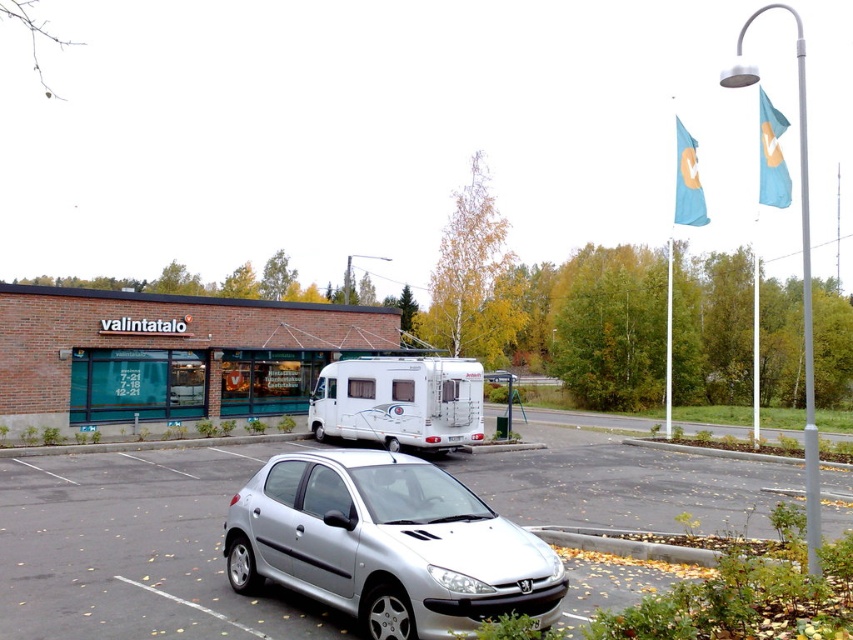
Looking at this image, does silver metallic car at center appear over silver metallic car at lower center?

Actually, silver metallic car at center is below silver metallic car at lower center.

Is silver metallic car at center to the left of silver metallic car at lower center from the viewer's perspective?

Incorrect, silver metallic car at center is not on the left side of silver metallic car at lower center.

Is point (97, 589) farther from camera compared to point (253, 534)?

Yes, point (97, 589) is behind point (253, 534).

What are the coordinates of `silver metallic car at center` in the screenshot? It's located at (134, 548).

Which is behind, point (434, 470) or point (424, 416)?

Point (424, 416)

Between silver metallic car at lower center and white glossy camper at center, which one is positioned higher?

white glossy camper at center is above.

The width and height of the screenshot is (853, 640). Find the location of `silver metallic car at lower center`. silver metallic car at lower center is located at coordinates (386, 545).

The width and height of the screenshot is (853, 640). Find the location of `silver metallic car at lower center`. silver metallic car at lower center is located at coordinates (386, 545).

Is silver metallic car at center smaller than white glossy camper at center?

Actually, silver metallic car at center might be larger than white glossy camper at center.

Which is above, silver metallic car at center or white glossy camper at center?

white glossy camper at center

Does point (601, 484) come farther from viewer compared to point (479, 426)?

No, (601, 484) is closer to viewer.

Image resolution: width=853 pixels, height=640 pixels. I want to click on silver metallic car at center, so click(134, 548).